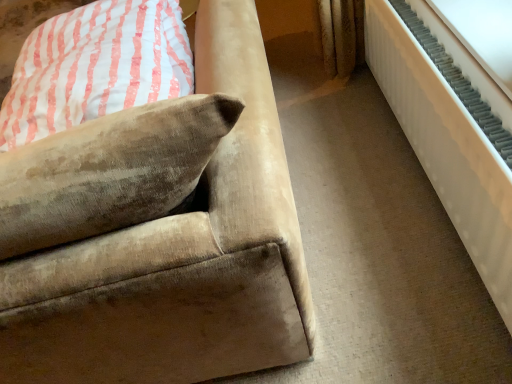
The image size is (512, 384). Describe the element at coordinates (447, 148) in the screenshot. I see `white textured radiator at right` at that location.

What do you see at coordinates (96, 67) in the screenshot? I see `velvet beige pillow at upper left` at bounding box center [96, 67].

Image resolution: width=512 pixels, height=384 pixels. In order to click on velvet beige couch at lower left in this screenshot , I will do `click(178, 259)`.

Locate an element on the screen. The image size is (512, 384). white textured radiator at right is located at coordinates (447, 148).

Who is taller, white textured radiator at right or velvet beige pillow at upper left?

white textured radiator at right is taller.

Are white textured radiator at right and velvet beige pillow at upper left beside each other?

They are not placed beside each other.

Does velvet beige couch at lower left contain white textured radiator at right?

That's incorrect, white textured radiator at right is not inside velvet beige couch at lower left.

You are a GUI agent. You are given a task and a screenshot of the screen. Output one action in this format:
    pyautogui.click(x=<x>, y=<y>)
    Task: Click on the studio couch lying above the white textured radiator at right (from the image's perspective)
    The width and height of the screenshot is (512, 384).
    Given the screenshot: What is the action you would take?
    pyautogui.click(x=178, y=259)

Is velvet beige couch at lower left looking in the opposite direction of white textured radiator at right?

velvet beige couch at lower left does not have its back to white textured radiator at right.

Between white textured radiator at right and velvet beige couch at lower left, which one appears on the left side from the viewer's perspective?

velvet beige couch at lower left.

From a real-world perspective, is white textured radiator at right on top of velvet beige couch at lower left?

Actually, white textured radiator at right is physically below velvet beige couch at lower left in the real world.

Is white textured radiator at right positioned in front of velvet beige couch at lower left?

That is False.

Which object is further away from the camera, velvet beige pillow at upper left or velvet beige couch at lower left?

velvet beige pillow at upper left.

From a real-world perspective, relative to velvet beige couch at lower left, is velvet beige pillow at upper left vertically above or below?

velvet beige pillow at upper left is above velvet beige couch at lower left.

Considering the positions of points (236, 306) and (57, 21), is point (236, 306) closer to camera compared to point (57, 21)?

Yes, point (236, 306) is in front of point (57, 21).

How different are the orientations of velvet beige couch at lower left and velvet beige pillow at upper left in degrees?

There is a 93.4-degree angle between the facing directions of velvet beige couch at lower left and velvet beige pillow at upper left.

Does velvet beige couch at lower left have a larger size compared to velvet beige pillow at upper left?

Yes, velvet beige couch at lower left is bigger than velvet beige pillow at upper left.

Considering the sizes of velvet beige pillow at upper left and white textured radiator at right in the image, is velvet beige pillow at upper left wider or thinner than white textured radiator at right?

Clearly, velvet beige pillow at upper left has more width compared to white textured radiator at right.

Is velvet beige pillow at upper left facing away from white textured radiator at right?

velvet beige pillow at upper left is not turned away from white textured radiator at right.

Is velvet beige pillow at upper left directly adjacent to white textured radiator at right?

No.

Find the location of a particular element. This screenshot has width=512, height=384. radiator below the velvet beige pillow at upper left (from the image's perspective) is located at coordinates (447, 148).

You are a GUI agent. You are given a task and a screenshot of the screen. Output one action in this format:
    pyautogui.click(x=<x>, y=<y>)
    Task: Click on the pillow that appears behind the white textured radiator at right
    This screenshot has height=384, width=512.
    Given the screenshot: What is the action you would take?
    pyautogui.click(x=96, y=67)

The height and width of the screenshot is (384, 512). Find the location of `studio couch on the left of the white textured radiator at right`. studio couch on the left of the white textured radiator at right is located at coordinates (178, 259).

Looking at the image, which one is located closer to white textured radiator at right, velvet beige couch at lower left or velvet beige pillow at upper left?

velvet beige couch at lower left is closer to white textured radiator at right.

Which object lies further to the anchor point velvet beige pillow at upper left, white textured radiator at right or velvet beige couch at lower left?

Based on the image, white textured radiator at right appears to be further to velvet beige pillow at upper left.

Based on the photo, looking at the image, which one is located further to velvet beige pillow at upper left, velvet beige couch at lower left or white textured radiator at right?

Based on the image, white textured radiator at right appears to be further to velvet beige pillow at upper left.

From the image, which object appears to be nearer to white textured radiator at right, velvet beige pillow at upper left or velvet beige couch at lower left?

The object closer to white textured radiator at right is velvet beige couch at lower left.

When comparing their distances from velvet beige couch at lower left, does velvet beige pillow at upper left or white textured radiator at right seem closer?

Among the two, velvet beige pillow at upper left is located nearer to velvet beige couch at lower left.

Looking at the image, which one is located closer to velvet beige couch at lower left, white textured radiator at right or velvet beige pillow at upper left?

Among the two, velvet beige pillow at upper left is located nearer to velvet beige couch at lower left.

This screenshot has height=384, width=512. In order to click on pillow located between velvet beige couch at lower left and white textured radiator at right in the left-right direction in this screenshot , I will do `click(96, 67)`.